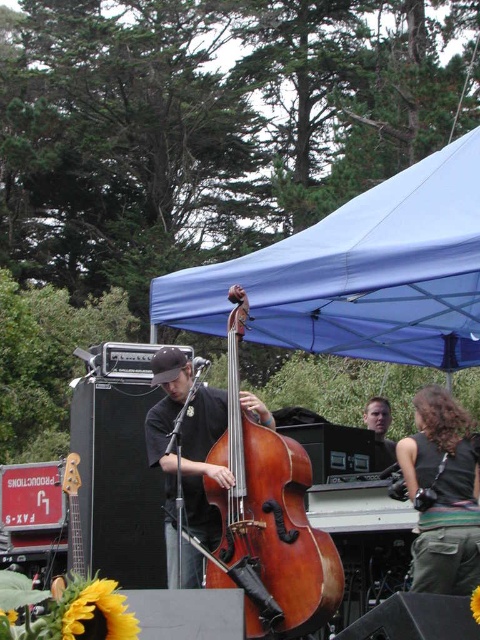
Can you confirm if blue fabric canopy at upper center is positioned to the right of dark brown leather jacket at lower right?

Yes, blue fabric canopy at upper center is to the right of dark brown leather jacket at lower right.

Is blue fabric canopy at upper center further to camera compared to dark brown leather jacket at lower right?

No, it is in front of dark brown leather jacket at lower right.

Is point (476, 301) farther from camera compared to point (448, 486)?

Yes, point (476, 301) is farther from viewer.

The width and height of the screenshot is (480, 640). Find the location of `blue fabric canopy at upper center`. blue fabric canopy at upper center is located at coordinates (359, 273).

Identify the location of dark brown leather jacket at lower right. click(442, 493).

In the scene shown: Is dark brown leather jacket at lower right closer to the viewer compared to matte black guitar at center?

Yes, dark brown leather jacket at lower right is closer to the viewer.

Locate an element on the screen. dark brown leather jacket at lower right is located at coordinates (442, 493).

You are a GUI agent. You are given a task and a screenshot of the screen. Output one action in this format:
    pyautogui.click(x=<x>, y=<y>)
    Task: Click on the dark brown leather jacket at lower right
    
    Given the screenshot: What is the action you would take?
    pyautogui.click(x=442, y=493)

Is blue fabric canopy at upper center smaller than matte black guitar at center?

Incorrect, blue fabric canopy at upper center is not smaller in size than matte black guitar at center.

Find the location of a particular element. The image size is (480, 640). blue fabric canopy at upper center is located at coordinates (359, 273).

Is point (440, 269) more distant than point (372, 406)?

No, (440, 269) is closer to viewer.

Where is `blue fabric canopy at upper center`? Image resolution: width=480 pixels, height=640 pixels. blue fabric canopy at upper center is located at coordinates (359, 273).